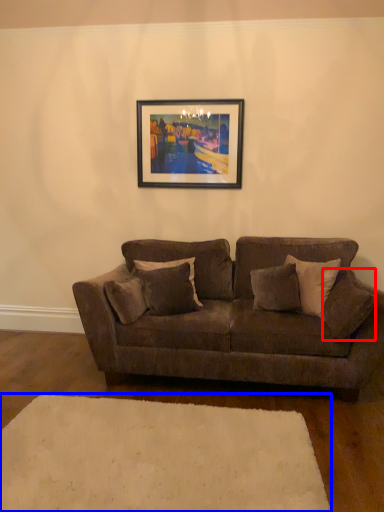
Question: Which of the following is the farthest to the observer, pillow (highlighted by a red box) or plain (highlighted by a blue box)?

Choices:
 (A) pillow
 (B) plain

Answer: (A)